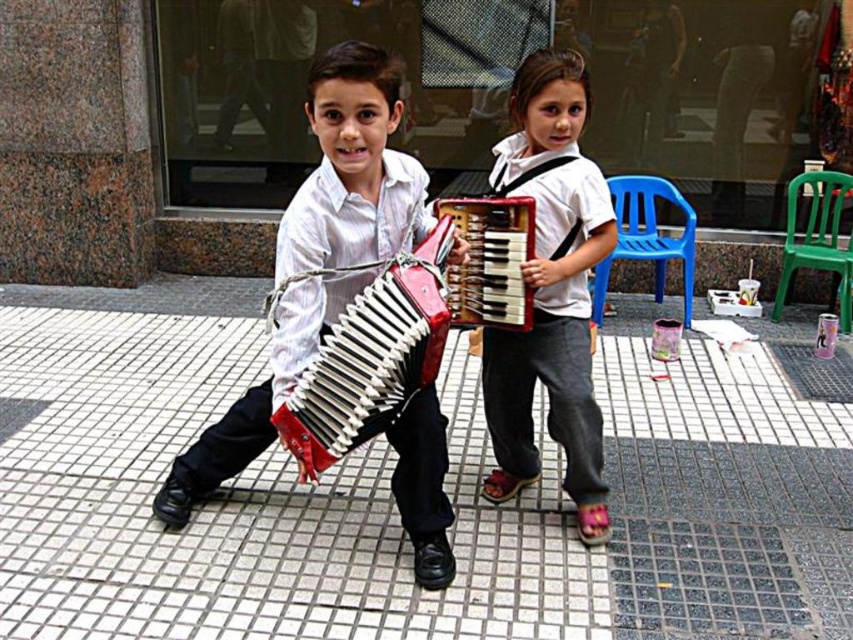
From the picture: You are a photographer standing at point (x=550, y=291). You want to take a picture of the white cotton shirt at center. Is the white cotton shirt at center visible in your current position?

The white cotton shirt at center is located at point (x=550, y=291), so yes, it is visible from your current position as you are standing exactly at that point.

You are standing at the center of the image and see the point at coordinates (352,168). Based on the scene description, what object is this point located on?

The point at coordinates (352,168) is located on the matte black accordion at center.